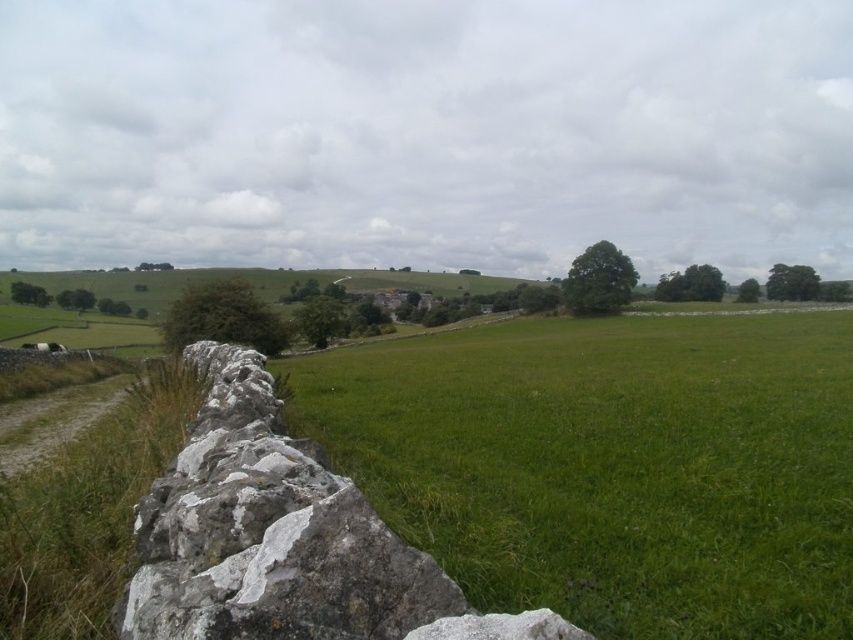
Question: Can you confirm if green grassy field at center is positioned above white rough stone at left?

Choices:
 (A) yes
 (B) no

Answer: (B)

Question: Is green grassy field at center below white rough stone at left?

Choices:
 (A) yes
 (B) no

Answer: (A)

Question: Which of the following is the closest to the observer?

Choices:
 (A) (271, 403)
 (B) (480, 474)

Answer: (A)

Question: Among these objects, which one is nearest to the camera?

Choices:
 (A) green grassy field at center
 (B) white rough stone at left

Answer: (B)

Question: Is green grassy field at center positioned before white rough stone at left?

Choices:
 (A) no
 (B) yes

Answer: (A)

Question: Which point is closer to the camera?

Choices:
 (A) green grassy field at center
 (B) white rough stone at left

Answer: (B)